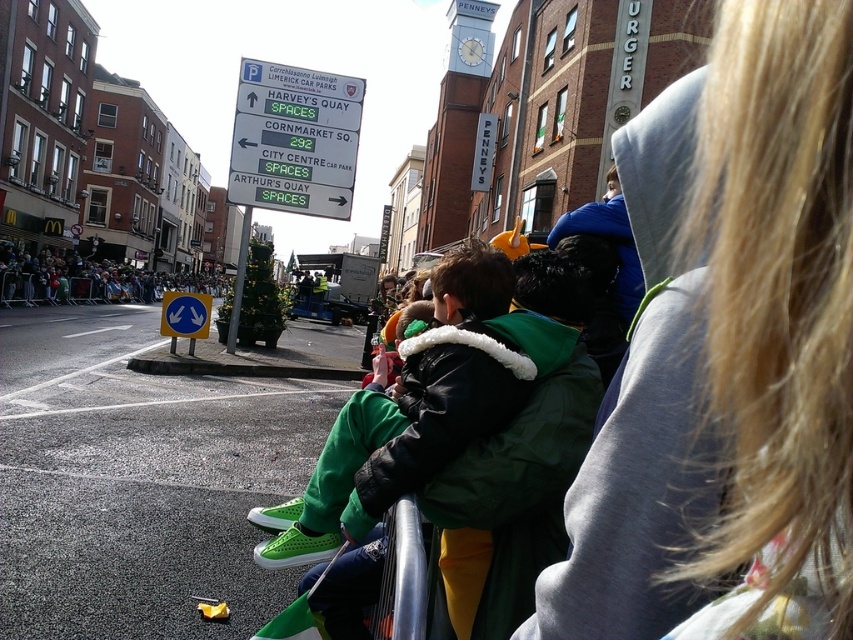
Question: Is white plastic sign at upper left positioned before metallic silver rail at lower center?

Choices:
 (A) yes
 (B) no

Answer: (B)

Question: Which object appears farthest from the camera in this image?

Choices:
 (A) white plastic sign at upper left
 (B) metallic silver rail at lower center
 (C) green fabric crowd at left

Answer: (C)

Question: Is green fleece jacket at center below metallic silver rail at lower center?

Choices:
 (A) yes
 (B) no

Answer: (B)

Question: From the image, what is the correct spatial relationship of green fleece jacket at center in relation to green fabric crowd at left?

Choices:
 (A) below
 (B) above

Answer: (A)

Question: Which point is farther from the camera taking this photo?

Choices:
 (A) (131, 284)
 (B) (374, 636)
 (C) (730, 410)

Answer: (A)

Question: Which point is closer to the camera?

Choices:
 (A) green fleece jacket at center
 (B) white plastic sign at upper left
 (C) green fabric crowd at left
 (D) metallic silver rail at lower center

Answer: (A)